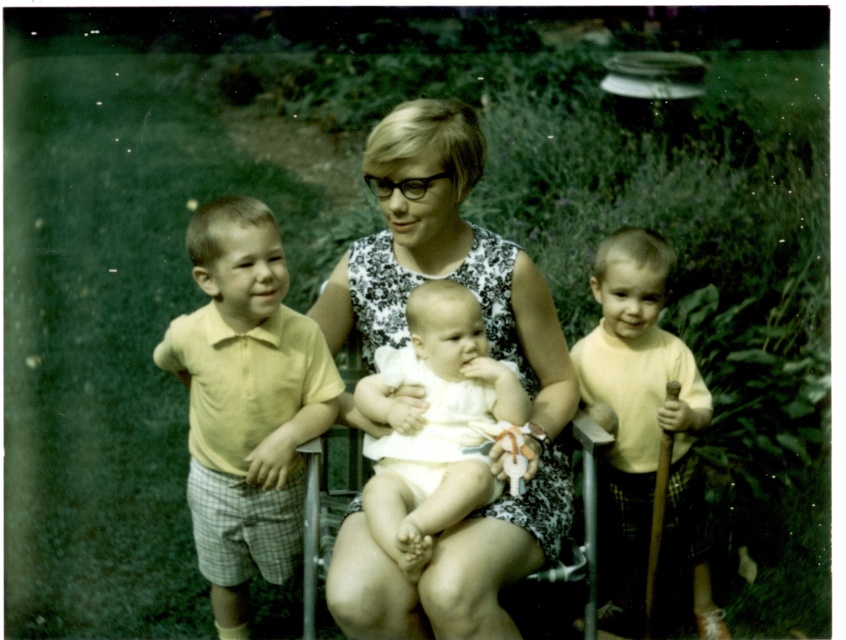
What are the coordinates of `yellow matte shirt at right` in the screenshot? It's located at (645, 417).

Does yellow matte shirt at right lie in front of white cloth baby at center?

No, yellow matte shirt at right is further to the viewer.

Based on the photo, measure the distance between yellow matte shirt at right and camera.

yellow matte shirt at right and camera are 7.98 feet apart.

Where is `yellow matte shirt at right`? Image resolution: width=846 pixels, height=640 pixels. yellow matte shirt at right is located at coordinates (645, 417).

Between yellow cotton shirt at left and yellow matte shirt at right, which one has less height?

yellow matte shirt at right is shorter.

Can you confirm if yellow cotton shirt at left is thinner than yellow matte shirt at right?

No.

Where is `yellow cotton shirt at left`? The width and height of the screenshot is (846, 640). yellow cotton shirt at left is located at coordinates (245, 403).

Who is more forward, (240, 408) or (407, 548)?

Point (407, 548) is in front.

Does yellow cotton shirt at left appear on the left side of white cloth baby at center?

Yes, yellow cotton shirt at left is to the left of white cloth baby at center.

The height and width of the screenshot is (640, 846). What do you see at coordinates (245, 403) in the screenshot?
I see `yellow cotton shirt at left` at bounding box center [245, 403].

The width and height of the screenshot is (846, 640). In order to click on yellow cotton shirt at left in this screenshot , I will do `click(245, 403)`.